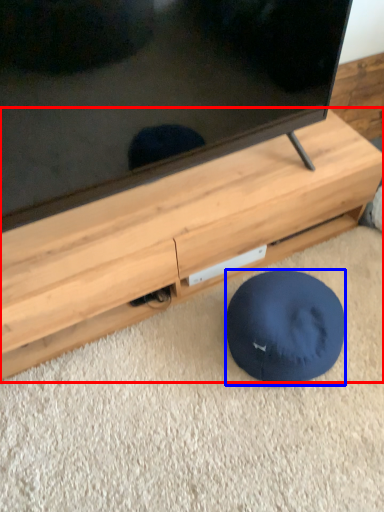
Question: Which object appears farthest to the camera in this image, furniture (highlighted by a red box) or dog bed (highlighted by a blue box)?

Choices:
 (A) furniture
 (B) dog bed

Answer: (B)